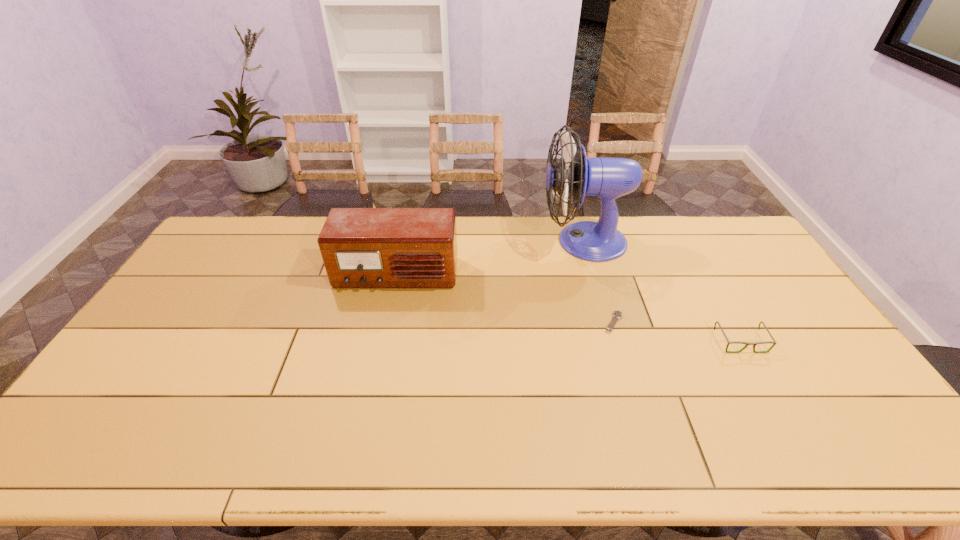
Find the location of a particular element. The height and width of the screenshot is (540, 960). vacant space situated 0.090m on the lens of the third tallest object is located at coordinates (762, 380).

Locate an element on the screen. vacant position located on the left of the shortest object is located at coordinates tap(468, 322).

You are a GUI agent. You are given a task and a screenshot of the screen. Output one action in this format:
    pyautogui.click(x=<x>, y=<y>)
    Task: Click on the object that is at the far edge
    
    Given the screenshot: What is the action you would take?
    [x=608, y=178]

Where is `vacant space at the far edge of the desktop`? This screenshot has height=540, width=960. vacant space at the far edge of the desktop is located at coordinates (289, 240).

Where is `vacant space at the near edge of the desktop`? This screenshot has height=540, width=960. vacant space at the near edge of the desktop is located at coordinates (634, 430).

In the image, there is a desktop. At what (x,y) coordinates should I click in order to perform the action: click on vacant space at the left edge. Please return your answer as a coordinate pair (x, y). This screenshot has width=960, height=540. Looking at the image, I should click on (239, 259).

Where is `free space at the right edge of the desktop`? The height and width of the screenshot is (540, 960). free space at the right edge of the desktop is located at coordinates [x=750, y=275].

You are a GUI agent. You are given a task and a screenshot of the screen. Output one action in this format:
    pyautogui.click(x=<x>, y=<y>)
    Task: Click on the blank space at the far left corner of the desktop
    Image resolution: width=960 pixels, height=540 pixels.
    Given the screenshot: What is the action you would take?
    pyautogui.click(x=236, y=218)

This screenshot has height=540, width=960. Find the location of `vacant space at the near right corner of the desktop`. vacant space at the near right corner of the desktop is located at coordinates (904, 458).

At what (x,y) coordinates should I click in order to perform the action: click on free point between the shortest object and the radio receiver. Please return your answer as a coordinate pair (x, y). Looking at the image, I should click on (505, 299).